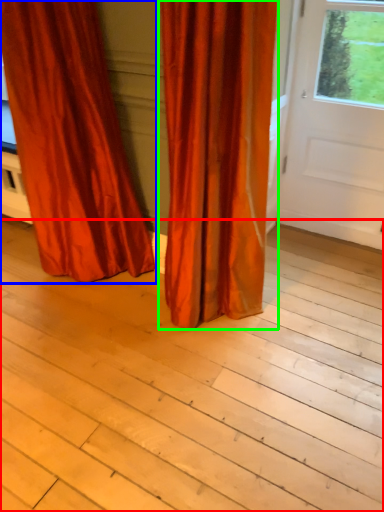
Question: Which object is positioned farthest from plank (highlighted by a red box)? Select from curtain (highlighted by a blue box) and curtain (highlighted by a green box).

Choices:
 (A) curtain
 (B) curtain

Answer: (A)